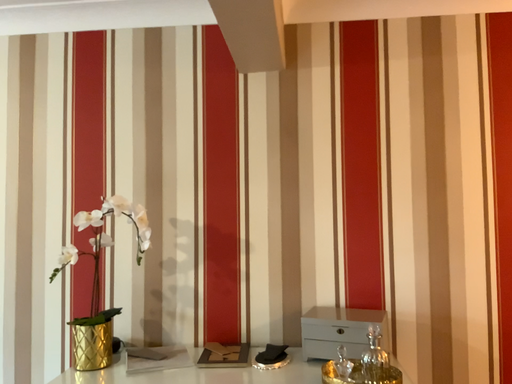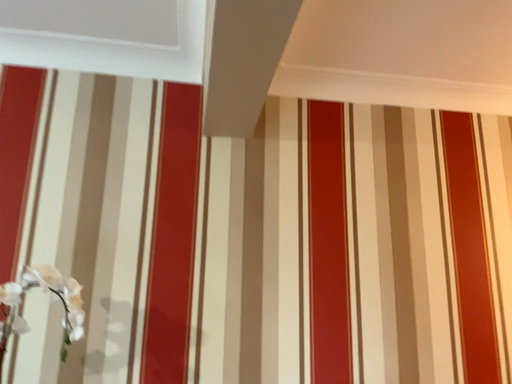
Question: Which way did the camera rotate in the video?

Choices:
 (A) rotated upward
 (B) rotated downward

Answer: (A)